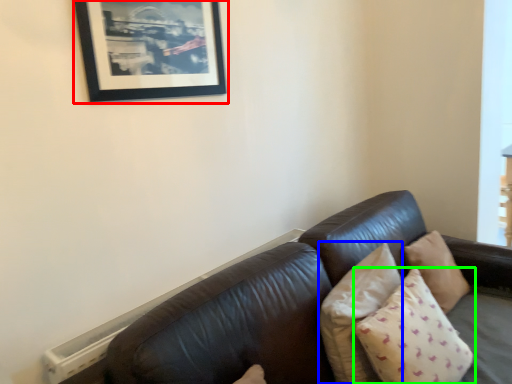
Question: Which is nearer to the picture frame (highlighted by a red box)? pillow (highlighted by a blue box) or pillow (highlighted by a green box).

Choices:
 (A) pillow
 (B) pillow

Answer: (A)